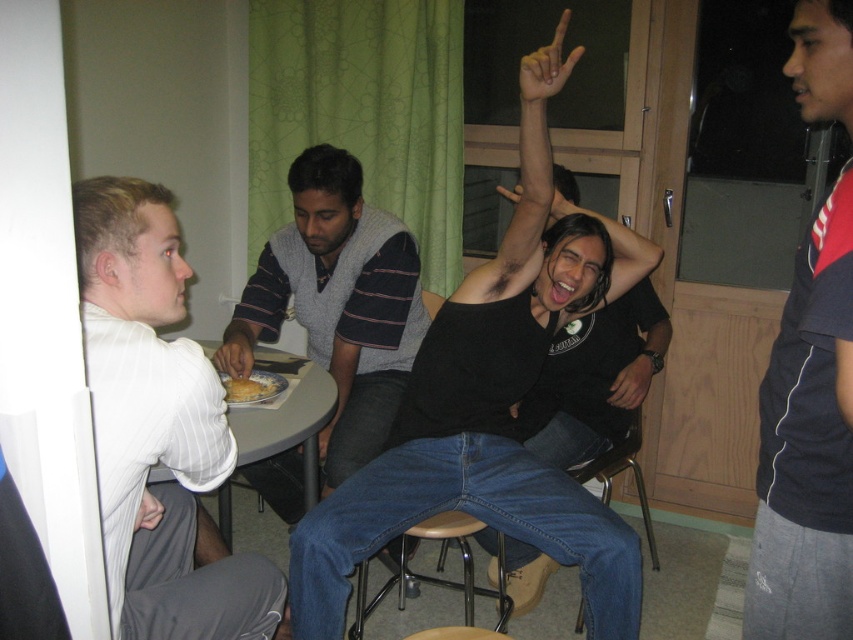
Question: Which of these objects is positioned closest to the striped sweater at center?

Choices:
 (A) golden brown bread at center
 (B) matte plastic fork at lower center
 (C) yellow painted finger at upper center

Answer: (B)

Question: Which of the following is the farthest from the observer?

Choices:
 (A) (276, 376)
 (B) (759, 497)

Answer: (A)

Question: Does black matte shirt at center appear on the left side of golden brown bread at center?

Choices:
 (A) yes
 (B) no

Answer: (B)

Question: Where is dark blue jersey at upper right located in relation to golden brown bread at center in the image?

Choices:
 (A) above
 (B) below

Answer: (A)

Question: Which object is farther from the camera taking this photo?

Choices:
 (A) white striped shirt at left
 (B) dark blue jersey at upper right

Answer: (A)

Question: Can you confirm if striped sweater at center is positioned above golden brown bread at center?

Choices:
 (A) yes
 (B) no

Answer: (A)